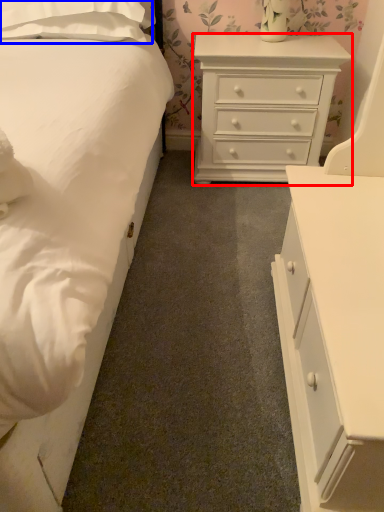
Question: Which object appears closest to the camera in this image, chest of drawers (highlighted by a red box) or pillow (highlighted by a blue box)?

Choices:
 (A) chest of drawers
 (B) pillow

Answer: (B)